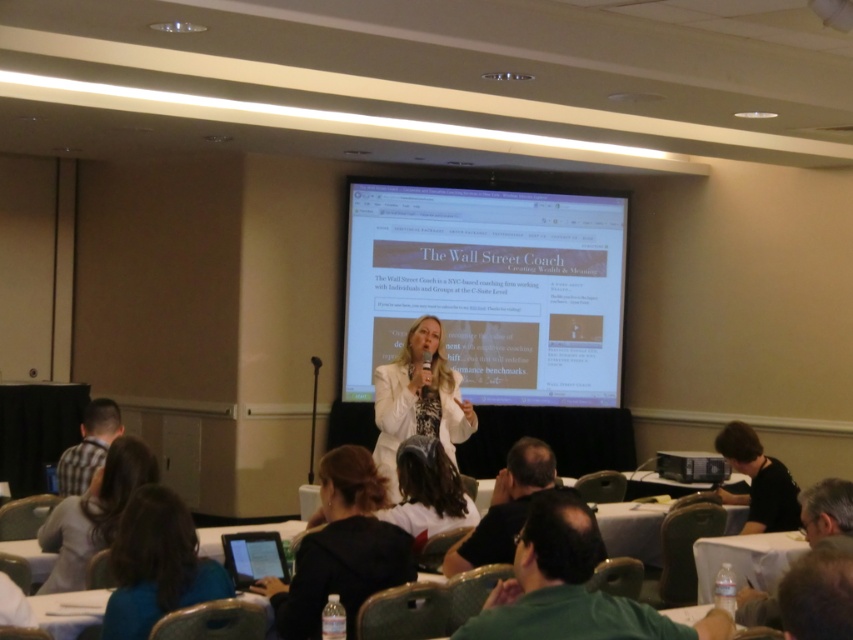
Question: Which point appears closest to the camera in this image?

Choices:
 (A) (444, 497)
 (B) (654, 636)

Answer: (B)

Question: Observing the image, what is the correct spatial positioning of white glossy projector screen at center in reference to dark brown hair at lower left?

Choices:
 (A) above
 (B) below

Answer: (A)

Question: Does dark brown hair at lower left have a smaller size compared to matte black microphone at center?

Choices:
 (A) yes
 (B) no

Answer: (B)

Question: Which is nearer to the dark blue shirt at lower left?

Choices:
 (A) white matte jacket at center
 (B) black fabric laptop at lower center

Answer: (B)

Question: Which object appears closest to the camera in this image?

Choices:
 (A) white fabric shirt at center
 (B) dark brown hair at lower left
 (C) dark blue shirt at lower left
 (D) green fabric shirt at lower right

Answer: (D)

Question: Can you confirm if black fabric laptop at lower center is positioned to the left of black plastic projector at lower right?

Choices:
 (A) yes
 (B) no

Answer: (A)